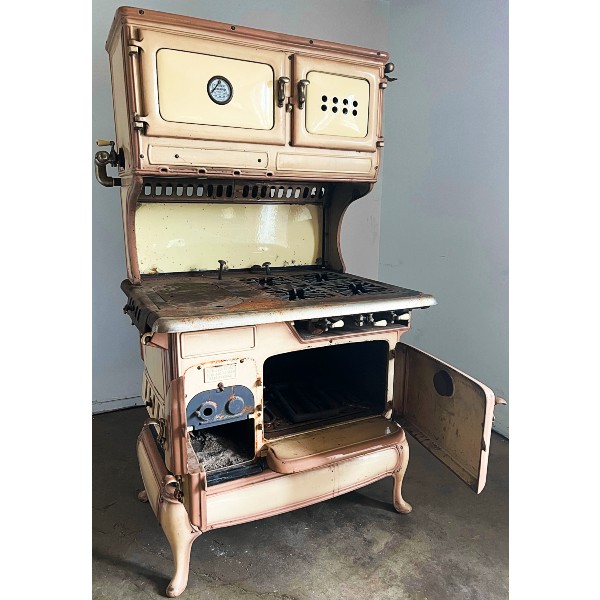
Identify the location of receptacle. The width and height of the screenshot is (600, 600). (288, 387).